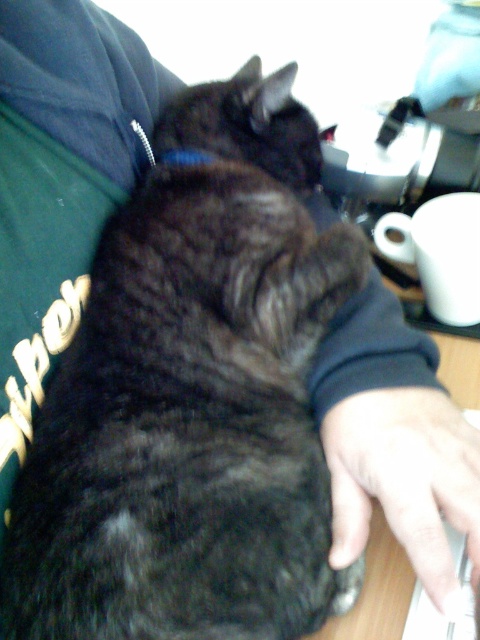
You are holding a ruler and want to measure the distance between the point at coordinates (478, 560) and yourself. According to the image, how far apart are you from that point?

The point at coordinates (478, 560) is 15.57 inches away from the viewer, so the distance between them is 15.57 inches.

You are a photographer trying to capture the interaction between the fuzzy black cat at center and the smooth skin hand at lower right. Based on their positions, which object is closer to the left edge of the image?

The fuzzy black cat at center is positioned on the left side of smooth skin hand at lower right, so the fuzzy black cat at center is closer to the left edge of the image.